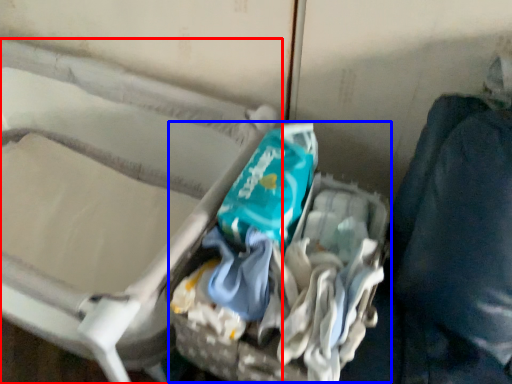
Question: Among these objects, which one is nearest to the camera, furniture (highlighted by a red box) or garbage (highlighted by a blue box)?

Choices:
 (A) furniture
 (B) garbage

Answer: (A)